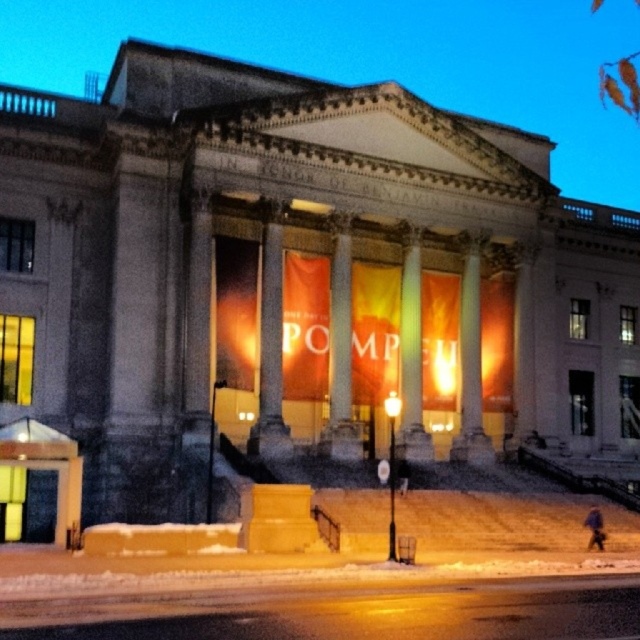
Question: Which point is closer to the camera?

Choices:
 (A) matte stone columns at center
 (B) white marble column at center
 (C) white marble pillar at center

Answer: (C)

Question: Is matte stone columns at center to the right of white marble column at center from the viewer's perspective?

Choices:
 (A) no
 (B) yes

Answer: (A)

Question: Which point is farther from the camera taking this photo?

Choices:
 (A) (77, 68)
 (B) (282, 426)
 (C) (474, 401)

Answer: (A)

Question: Is white marble pillar at center smaller than white marble column at center?

Choices:
 (A) no
 (B) yes

Answer: (B)

Question: Among these points, which one is nearest to the camera?

Choices:
 (A) (282, 451)
 (B) (518, 81)
 (C) (461, 356)

Answer: (A)

Question: From the image, what is the correct spatial relationship of matte stone columns at center in relation to white marble column at center?

Choices:
 (A) left
 (B) right

Answer: (A)